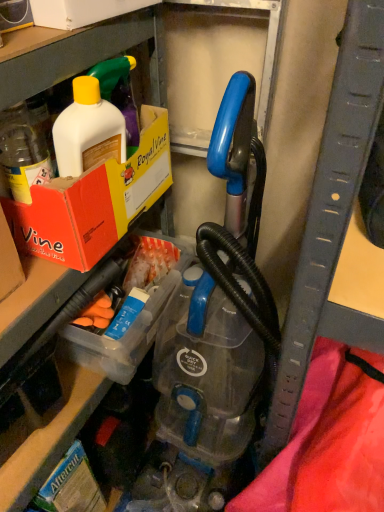
Question: In terms of height, does orange cardboard box at upper left look taller or shorter compared to clear plastic container at center?

Choices:
 (A) tall
 (B) short

Answer: (A)

Question: Considering their positions, is orange cardboard box at upper left located in front of or behind clear plastic container at center?

Choices:
 (A) behind
 (B) front

Answer: (B)

Question: From the image's perspective, is orange cardboard box at upper left positioned above or below clear plastic container at center?

Choices:
 (A) above
 (B) below

Answer: (A)

Question: Is clear plastic container at center taller or shorter than orange cardboard box at upper left?

Choices:
 (A) tall
 (B) short

Answer: (B)

Question: Is clear plastic container at center in front of or behind orange cardboard box at upper left in the image?

Choices:
 (A) behind
 (B) front

Answer: (A)

Question: Based on their positions, is clear plastic container at center located to the left or right of orange cardboard box at upper left?

Choices:
 (A) right
 (B) left

Answer: (A)

Question: Is clear plastic container at center wider or thinner than orange cardboard box at upper left?

Choices:
 (A) wide
 (B) thin

Answer: (A)